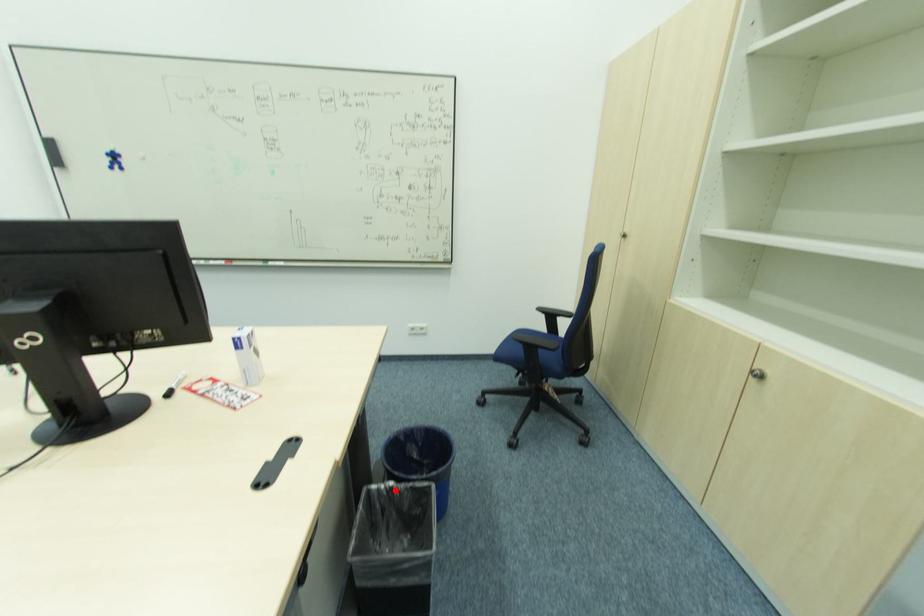
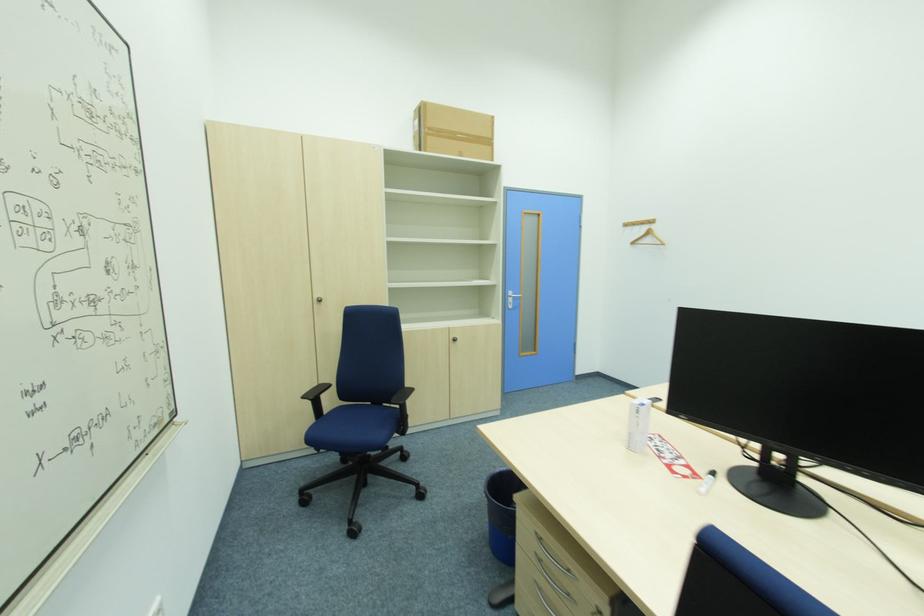
Question: I am providing you with two images of the same scene from different viewpoints. A red point is marked on the first image. Is the red point's position out of view in image 2?

Choices:
 (A) Yes
 (B) No

Answer: (A)